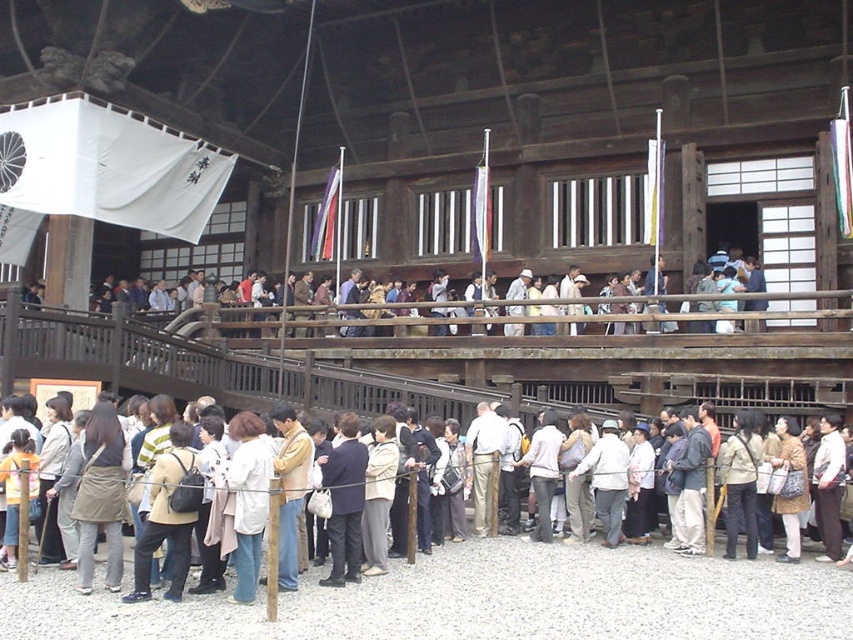
Which is above, light brown wooden railing at upper center or matte beige coat at center?

light brown wooden railing at upper center is above.

Who is more forward, (x=231, y=307) or (x=380, y=458)?

Point (x=380, y=458) is more forward.

Locate an element on the screen. This screenshot has width=853, height=640. light brown wooden railing at upper center is located at coordinates (680, 304).